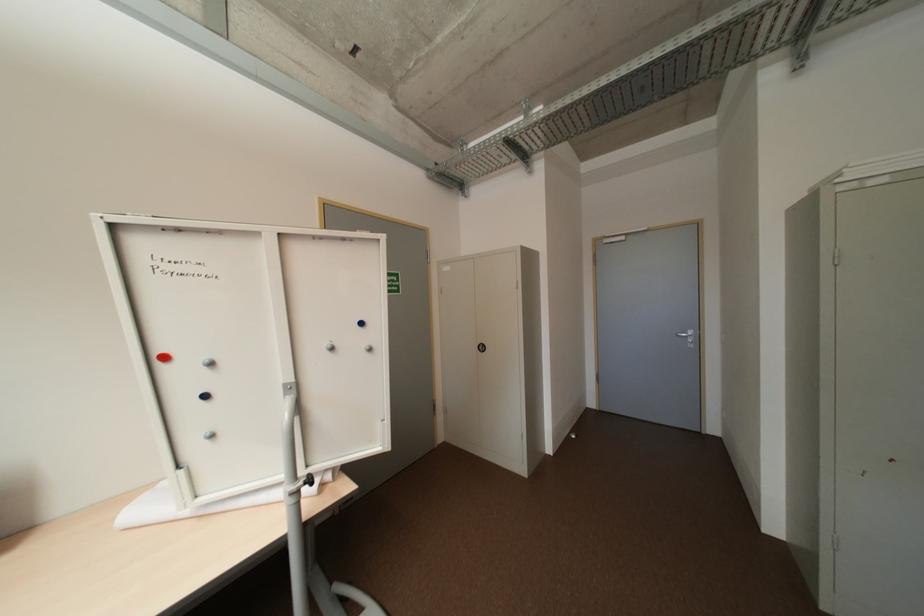
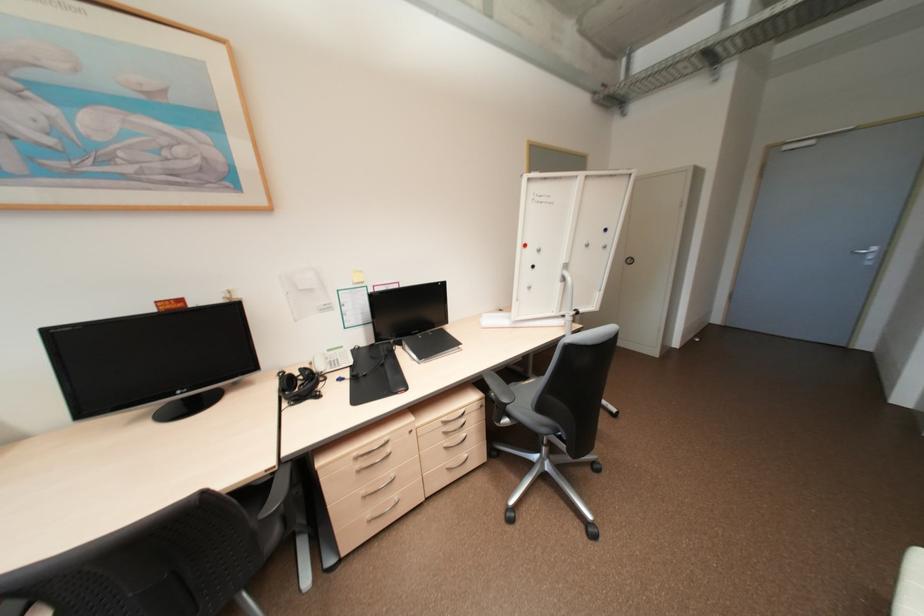
Locate, in the second image, the point that corresponds to [212,395] in the first image.

(539, 265)